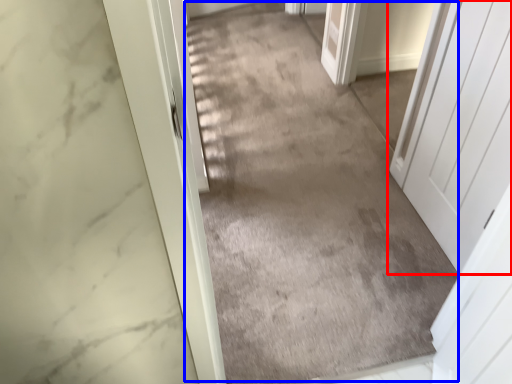
Question: Among these objects, which one is nearest to the camera, door (highlighted by a red box) or path (highlighted by a blue box)?

Choices:
 (A) door
 (B) path

Answer: (A)